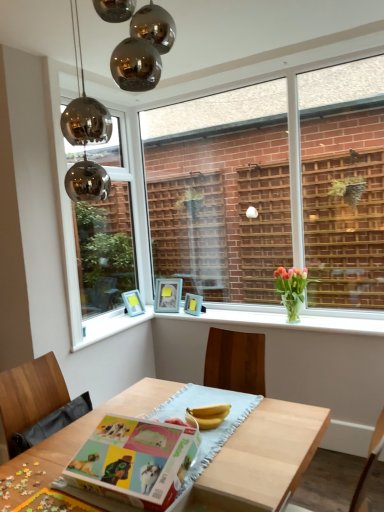
Question: Visually, is yellow matte bananas at center positioned to the left or to the right of matte paperboard book at center?

Choices:
 (A) right
 (B) left

Answer: (A)

Question: From a real-world perspective, is yellow matte bananas at center physically located above or below matte paperboard book at center?

Choices:
 (A) above
 (B) below

Answer: (B)

Question: Estimate the real-world distances between objects in this image. Which object is closer to the matte paperboard book at center?

Choices:
 (A) matte blue picture frame at center, marked as the third picture frame in a left-to-right arrangement
 (B) white glossy window sill at center
 (C) light wood table at center
 (D) yellow matte bananas at center
 (E) matte blue picture frame at upper center, the 2th picture frame from the left

Answer: (C)

Question: Which object is positioned farthest from the matte paperboard book at center?

Choices:
 (A) metallic glass window at upper left, which ranks as the 1th window in left-to-right order
 (B) clear glass window at center, which ranks as the first window in right-to-left order
 (C) light wood table at center
 (D) matte blue picture frame at upper left, placed as the first picture frame when sorted from left to right
 (E) yellow matte bananas at center

Answer: (B)